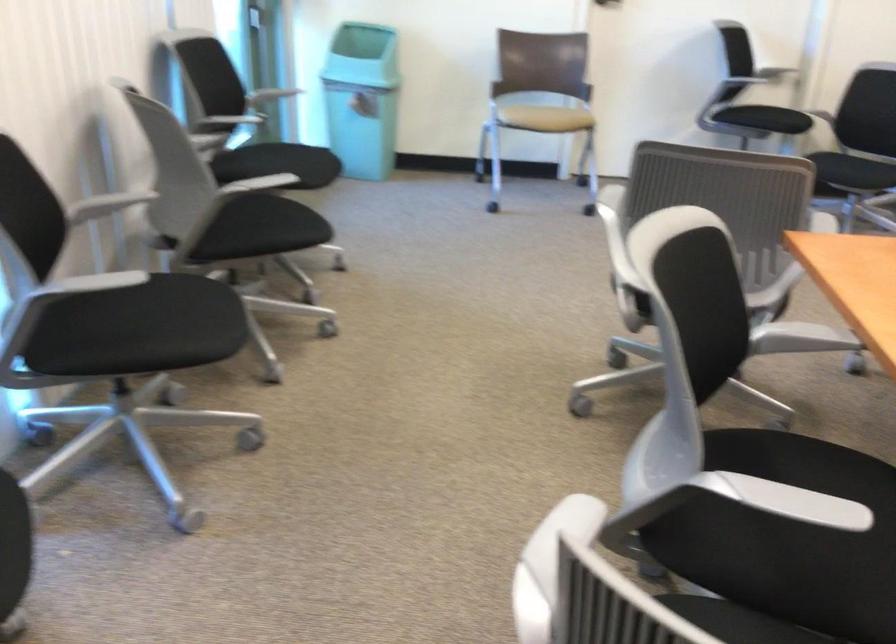
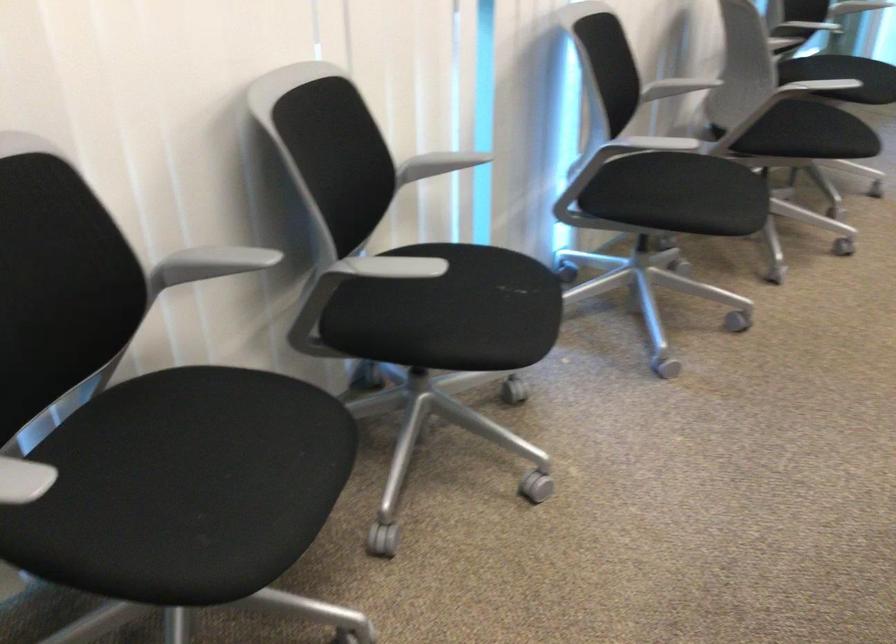
The point at (269, 243) is marked in the first image. Where is the corresponding point in the second image?

(810, 134)